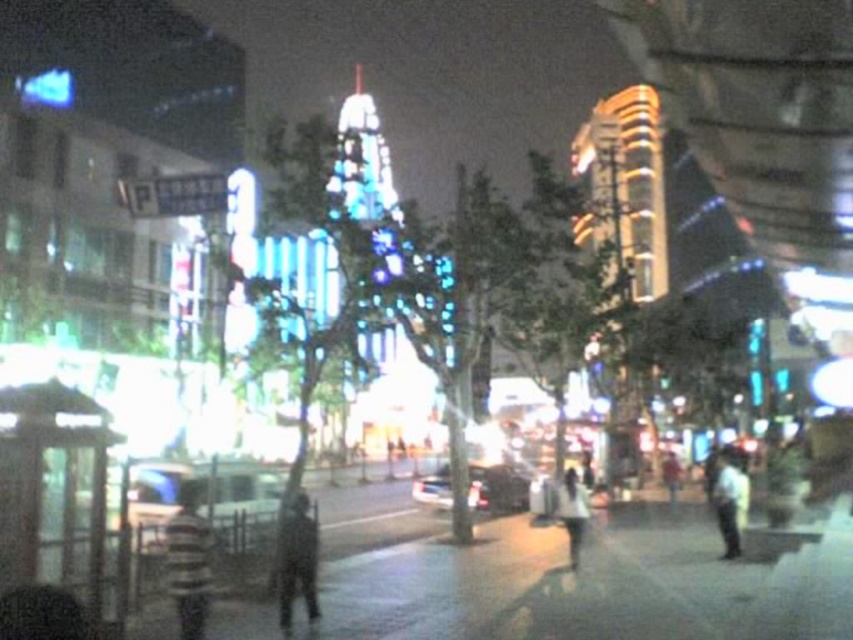
Question: Does white matte shirt at right lie in front of white matte shirt at center?

Choices:
 (A) no
 (B) yes

Answer: (A)

Question: Is white matte shirt at right bigger than white matte shirt at center?

Choices:
 (A) yes
 (B) no

Answer: (A)

Question: Can you confirm if striped fabric shirt at center is wider than white matte shirt at center?

Choices:
 (A) no
 (B) yes

Answer: (B)

Question: Which point is farther from the camera taking this photo?

Choices:
 (A) (180, 584)
 (B) (573, 561)
 (C) (746, 474)
 (D) (287, 518)

Answer: (C)

Question: Which object appears farthest from the camera in this image?

Choices:
 (A) striped fabric shirt at center
 (B) white matte shirt at center
 (C) dark textured coat at center

Answer: (B)

Question: Estimate the real-world distances between objects in this image. Which object is farther from the white matte shirt at center?

Choices:
 (A) dark textured coat at center
 (B) white matte shirt at right

Answer: (A)